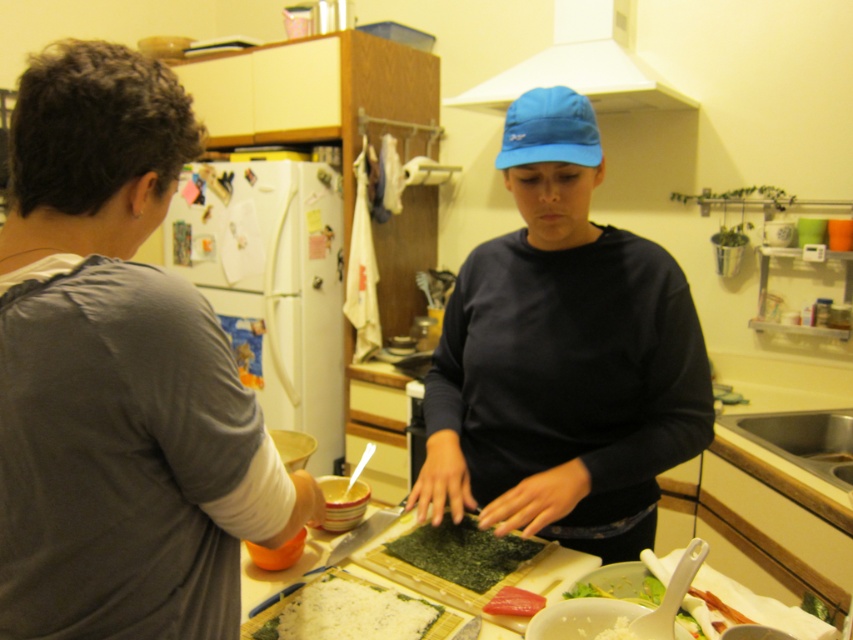
Is white rice paper at center above green matte seaweed at center?

No, white rice paper at center is not above green matte seaweed at center.

Is point (244, 634) positioned in front of point (469, 572)?

Yes, point (244, 634) is closer to viewer.

Where is `white rice paper at center`? white rice paper at center is located at coordinates (347, 612).

Is dark blue fabric shirt at center bigger than green matte seaweed at center?

Indeed, dark blue fabric shirt at center has a larger size compared to green matte seaweed at center.

Which is below, dark blue fabric shirt at center or green matte seaweed at center?

green matte seaweed at center is below.

Where is `dark blue fabric shirt at center`? dark blue fabric shirt at center is located at coordinates (561, 356).

Is dark blue fabric shirt at center thinner than white creamy salad at lower right?

No, dark blue fabric shirt at center is not thinner than white creamy salad at lower right.

Can you confirm if dark blue fabric shirt at center is smaller than white creamy salad at lower right?

Incorrect, dark blue fabric shirt at center is not smaller in size than white creamy salad at lower right.

At what (x,y) coordinates should I click in order to perform the action: click on dark blue fabric shirt at center. Please return your answer as a coordinate pair (x, y). This screenshot has height=640, width=853. Looking at the image, I should click on (561, 356).